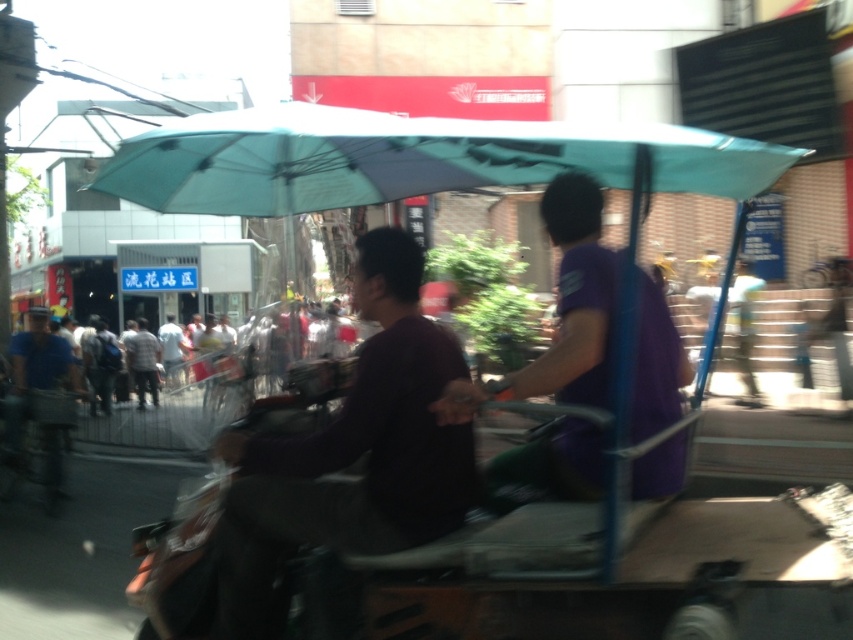
You are a photographer standing in the middle of the street. You see a purple matte shirt at center and a blue uniform at left. Which one is taller?

The purple matte shirt at center is much taller than the blue uniform at left.

Looking at this image, you are a delivery person needing to choose between the metallic purple golf cart at center and the light gray shirt at center for transporting packages. Which one can carry more items?

The light gray shirt at center is larger than the metallic purple golf cart at center, so it can carry more items.